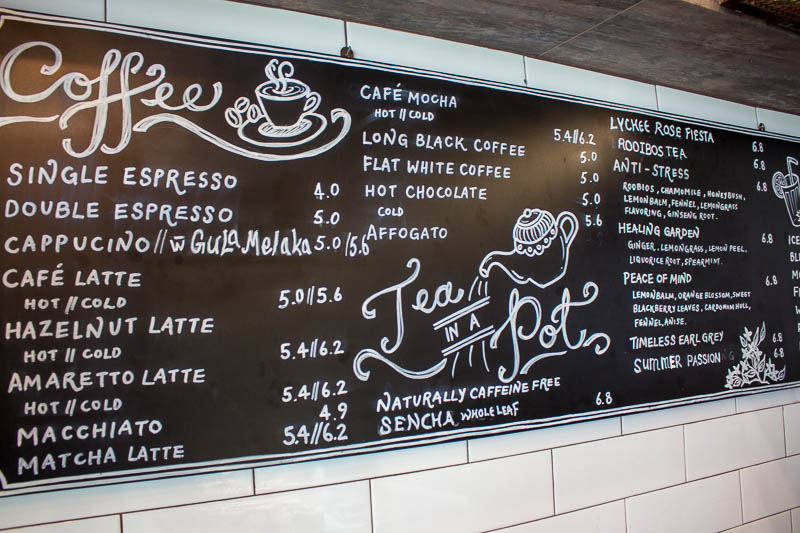
This screenshot has height=533, width=800. Identify the location of saucer. (246, 128).